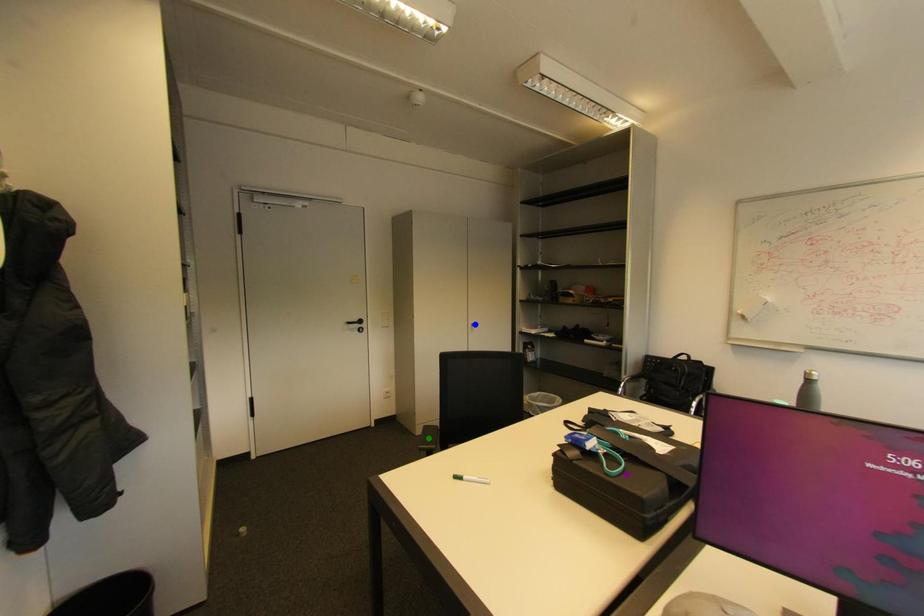
Order these from farthest to nearest:
A) green point
B) purple point
C) blue point

blue point < green point < purple point